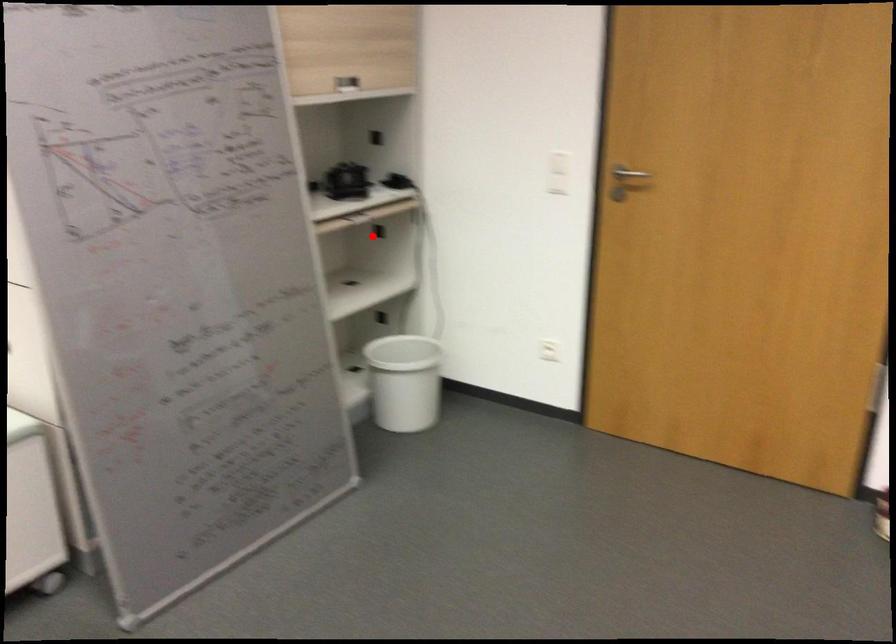
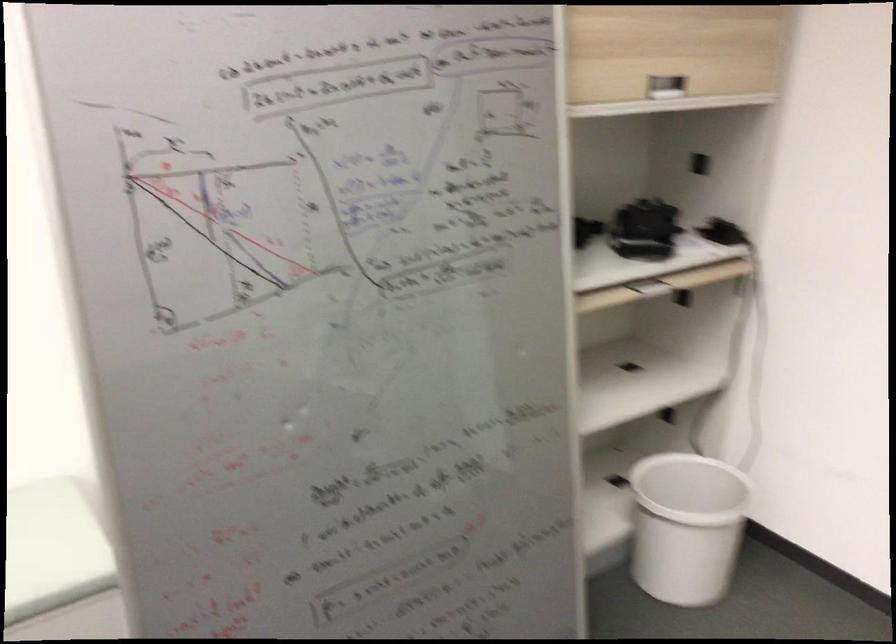
The point at the highlighted location is marked in the first image. Where is the corresponding point in the second image?

(675, 303)